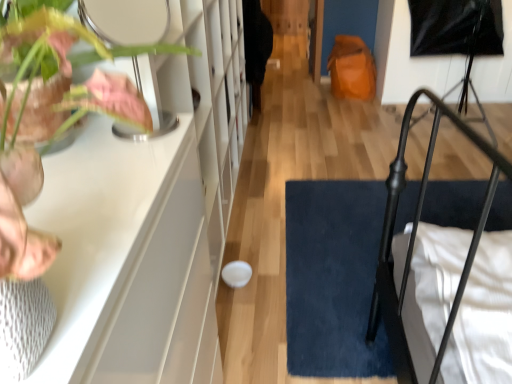
Identify the location of vacant space underneath matte pink leaf at left (from a real-world perspective). This screenshot has height=384, width=512. (104, 167).